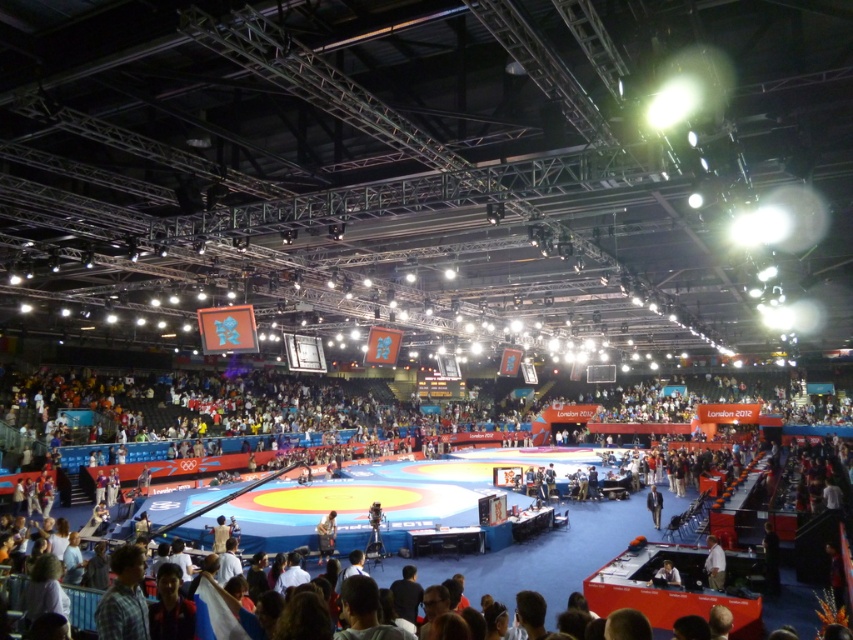
You are a photographer positioned at the center of the wrestling mat. You want to capture a photo of the white shirt at lower right. In which direction should you aim your camera?

The white shirt at lower right is located at point 0.881 on the x axis and 0.838 on the y axis. Since you are at the center of the mat, you should aim your camera to the lower right direction to capture the white shirt at lower right.

You are a photographer positioned at the front of the arena. You need to capture a photo of both the white shirt at lower right and the blue fabric jacket at center without any obstructions. Based on their positions, which one should you focus on first to ensure both are in frame?

The white shirt at lower right is above the blue fabric jacket at center, so you should focus on the blue fabric jacket at center first to ensure both are in frame.

You are a photographer positioned at the back of the arena. You want to take a photo of the blue fabric mat at center without the light brown leather jacket at lower center appearing in the frame. Is this possible given their positions?

The blue fabric mat at center is in front of the light brown leather jacket at lower center, so the jacket will block part of the mat in the photo. To avoid the jacket, move to a different angle where the mat is not obscured.